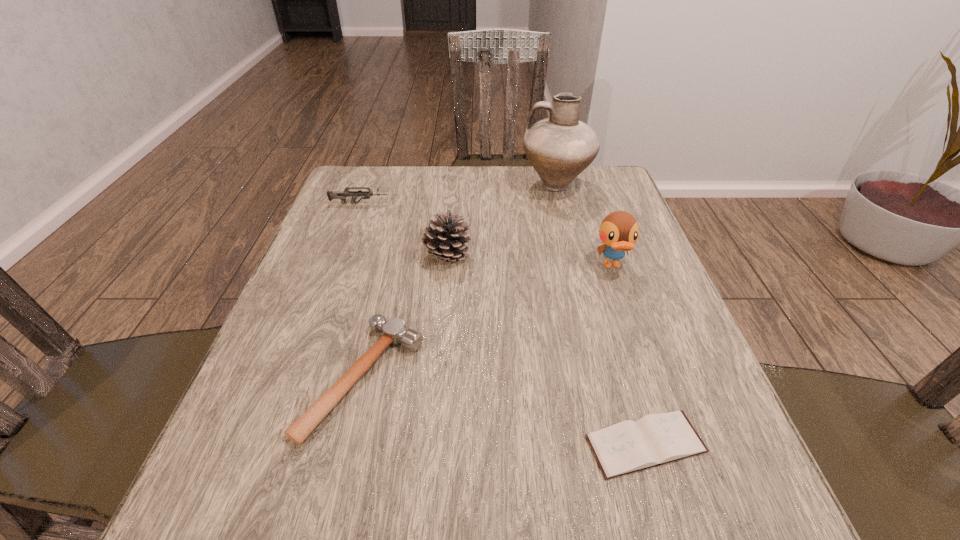
At what (x,y) coordinates should I click in order to perform the action: click on duck that is at the right edge. Please return your answer as a coordinate pair (x, y). Looking at the image, I should click on click(619, 231).

Where is `diary that is at the right edge`? This screenshot has width=960, height=540. diary that is at the right edge is located at coordinates (629, 446).

What are the coordinates of `object that is at the far left corner` in the screenshot? It's located at (341, 195).

At what (x,y) coordinates should I click in order to perform the action: click on object that is at the far right corner. Please return your answer as a coordinate pair (x, y). Looking at the image, I should click on (559, 148).

At what (x,y) coordinates should I click in order to perform the action: click on object at the near right corner. Please return your answer as a coordinate pair (x, y). Looking at the image, I should click on (629, 446).

In the image, there is a desktop. Identify the location of vacant space at the far edge. (433, 208).

Where is `vacant area at the near edge`? vacant area at the near edge is located at coordinates (575, 491).

Locate an element on the screen. The image size is (960, 540). free space at the left edge of the desktop is located at coordinates (x=261, y=388).

Where is `blank space at the right edge of the desktop`? The image size is (960, 540). blank space at the right edge of the desktop is located at coordinates (581, 246).

What are the coordinates of `blank space at the far left corner of the desktop` in the screenshot? It's located at (340, 183).